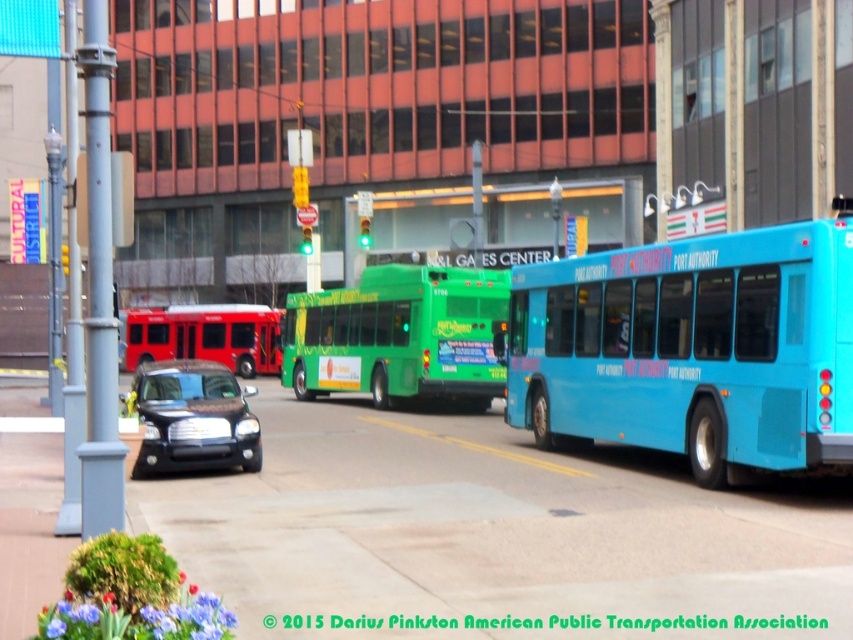
Question: Is green matte bus at center bigger than metallic red bus at left?

Choices:
 (A) yes
 (B) no

Answer: (B)

Question: Which object appears farthest from the camera in this image?

Choices:
 (A) blue rubber bus at right
 (B) metallic red bus at left
 (C) green matte bus at center
 (D) satin black sedan at center

Answer: (B)

Question: Which object is farther from the camera taking this photo?

Choices:
 (A) satin black sedan at center
 (B) metallic red bus at left

Answer: (B)

Question: Does green matte bus at center come in front of satin black sedan at center?

Choices:
 (A) yes
 (B) no

Answer: (B)

Question: In this image, where is green matte bus at center located relative to satin black sedan at center?

Choices:
 (A) right
 (B) left

Answer: (A)

Question: Which of the following is the closest to the observer?

Choices:
 (A) satin black sedan at center
 (B) green matte bus at center
 (C) blue rubber bus at right
 (D) metallic red bus at left

Answer: (C)